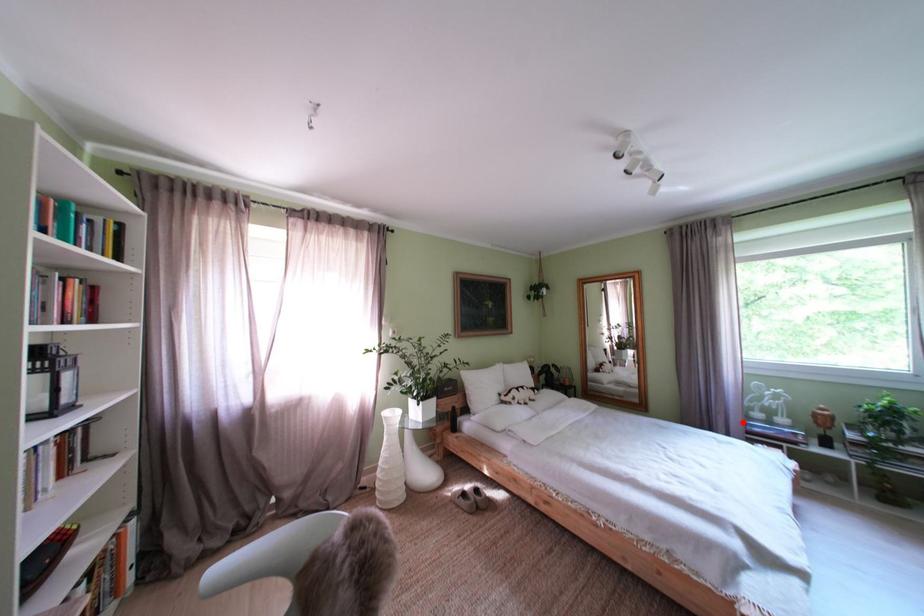
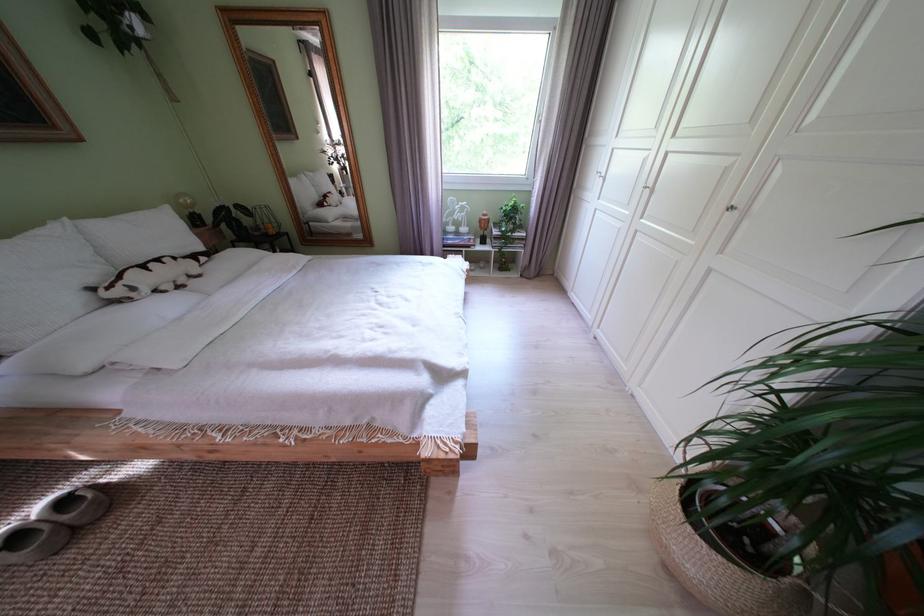
Locate, in the second image, the point that corresponds to the highlighted location in the first image.

(445, 241)